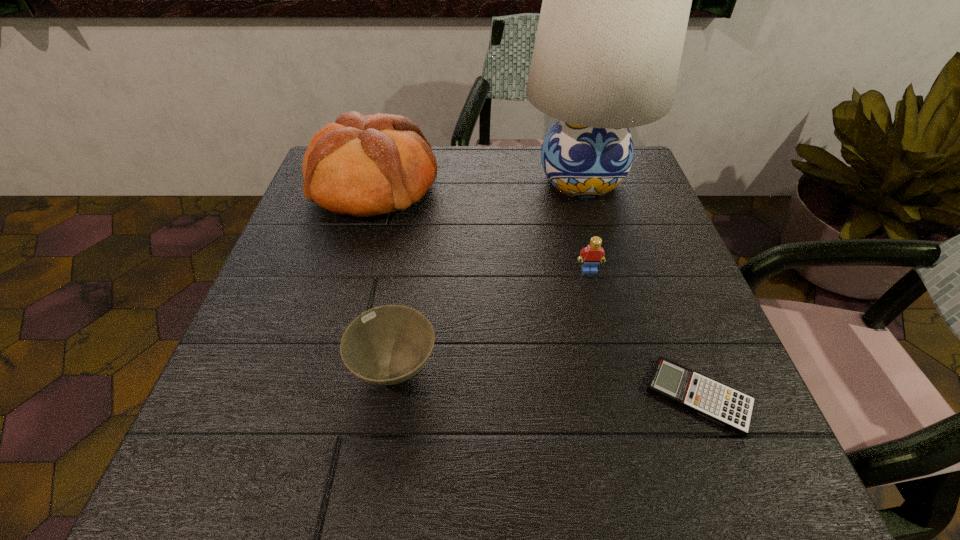
Locate an element on the screen. This screenshot has width=960, height=540. vacant region at the near edge of the desktop is located at coordinates (366, 458).

Locate an element on the screen. The height and width of the screenshot is (540, 960). vacant area at the left edge of the desktop is located at coordinates (344, 223).

At what (x,y) coordinates should I click in order to perform the action: click on vacant area at the right edge. Please return your answer as a coordinate pair (x, y). Looking at the image, I should click on (615, 201).

At what (x,y) coordinates should I click in order to perform the action: click on vacant space at the far right corner. Please return your answer as a coordinate pair (x, y). Looking at the image, I should click on (612, 191).

Find the location of a particular element. vacant space that's between the bowl and the lampshade is located at coordinates (488, 274).

Find the location of a particular element. vacant point located between the third farthest object and the tallest object is located at coordinates coord(586,225).

Where is `free space between the bowl and the third nearest object`? The height and width of the screenshot is (540, 960). free space between the bowl and the third nearest object is located at coordinates (492, 319).

Locate an element on the screen. The height and width of the screenshot is (540, 960). free space that is in between the bread and the shortest object is located at coordinates (537, 292).

Identify the location of free space between the calculator and the bowl. (546, 382).

Identify the location of free spot between the bowl and the bread. (385, 277).